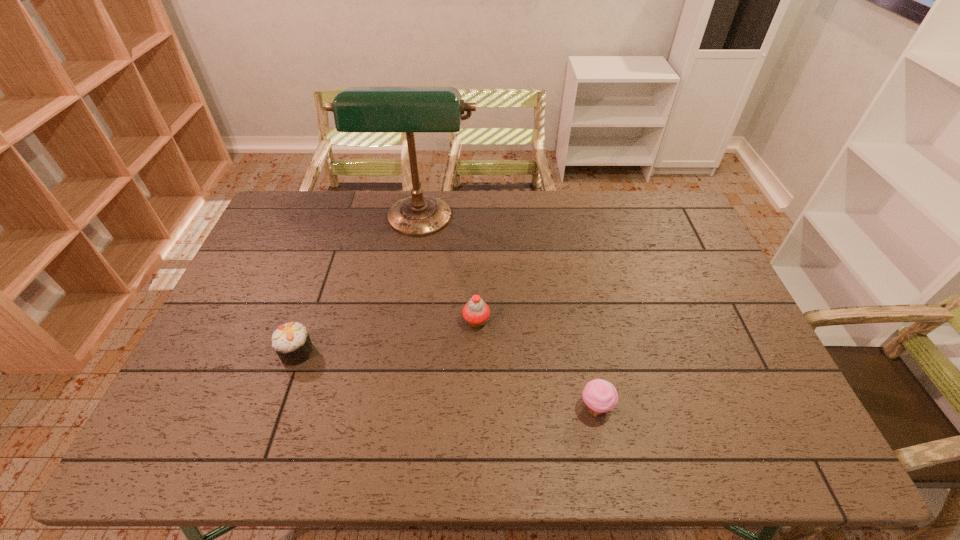
Identify the location of the third closest object relative to the table lamp. click(600, 396).

Locate an element on the screen. The height and width of the screenshot is (540, 960). cupcake that is the second closest one to the second farthest object is located at coordinates (291, 341).

Select which cupcake is the closest to the farthest cupcake. Please provide its 2D coordinates. Your answer should be formatted as a tuple, i.e. [(x, y)], where the tuple contains the x and y coordinates of a point satisfying the conditions above.

[(600, 396)]

The width and height of the screenshot is (960, 540). Identify the location of blank area in the image that satisfies the following two spatial constraints: 1. above the green lampshade of the rightmost object; 2. on the left side of the tallest object. (391, 408).

The height and width of the screenshot is (540, 960). I want to click on blank area in the image that satisfies the following two spatial constraints: 1. on the front side of the rightmost object; 2. on the right side of the farthest cupcake, so click(x=475, y=408).

Locate an element on the screen. This screenshot has height=540, width=960. vacant space that satisfies the following two spatial constraints: 1. on the front side of the third nearest object; 2. on the left side of the rightmost object is located at coordinates (475, 408).

Identify the location of free space that satisfies the following two spatial constraints: 1. on the back side of the second cupcake from left to right; 2. on the right side of the leftmost cupcake. (307, 321).

At what (x,y) coordinates should I click in order to perform the action: click on vacant position in the image that satisfies the following two spatial constraints: 1. above the green lampshade of the table lamp; 2. on the left side of the rightmost object. Please return your answer as a coordinate pair (x, y). The height and width of the screenshot is (540, 960). Looking at the image, I should click on (391, 408).